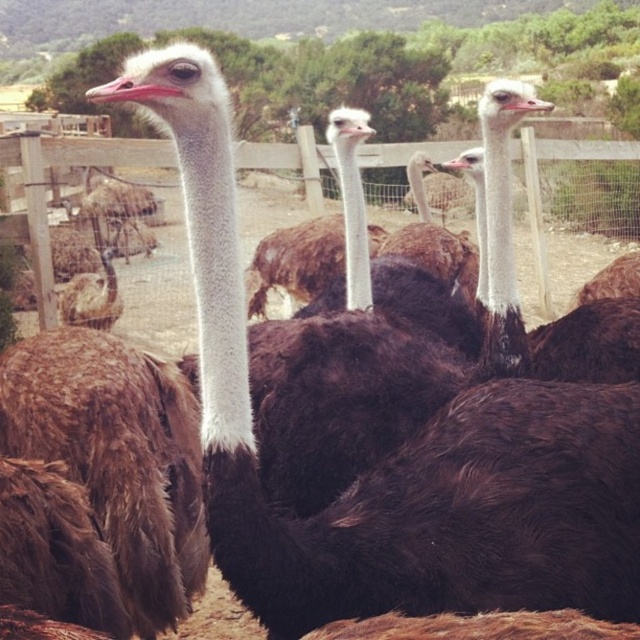
You are standing in front of the fenced enclosure with the ostriches. You notice two points marked in the image. Which point, point (525,129) or point (406,252), is closer to you?

Point (406,252) is closer to you because it is less further to the camera than point (525,129).

You are standing in front of the enclosure and want to take a photo of the wooden fence at center. Where should you position yourself to capture it in the frame?

The wooden fence at center is located at point (68,166), so you should position yourself directly in front of that coordinate to capture it in the frame.

You are standing at point A at point (317, 198). You want to walk to point B, which is 7.02 meters away from you. Is there an ostrich between you and point B?

The distance between point A at point (317, 198) and point B is 7.02 meters. Since the ostriches are in the foreground and partially obscured, it is possible that an ostrich is between you and point B. However, without knowing the exact path or the positions of the ostriches relative to the points, it is uncertain if an ostrich is blocking the way.